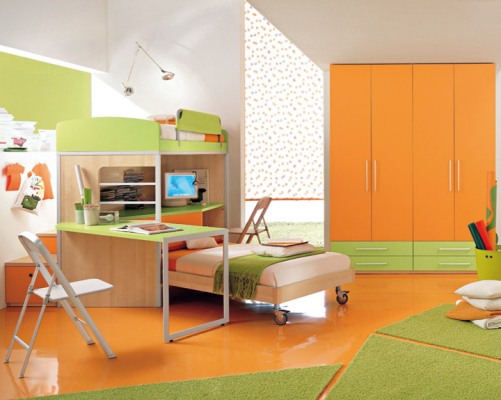
Where is `stack of towels`? stack of towels is located at coordinates (492, 286), (477, 302), (476, 312), (482, 320).